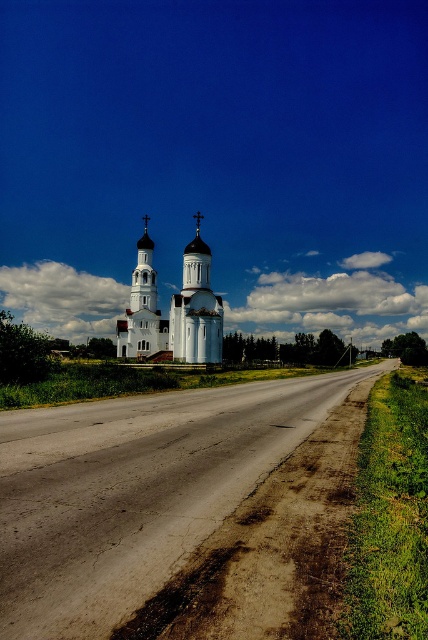
Question: Does white smooth church at center have a smaller size compared to white stone spire at center?

Choices:
 (A) no
 (B) yes

Answer: (A)

Question: Which object is positioned closest to the white stone spire at center?

Choices:
 (A) brown dirt track at center
 (B) white smooth church at center

Answer: (B)

Question: Is brown dirt track at center bigger than white stone spire at center?

Choices:
 (A) no
 (B) yes

Answer: (A)

Question: Based on their relative distances, which object is farther from the white smooth church at center?

Choices:
 (A) brown dirt track at center
 (B) white stone spire at center

Answer: (A)

Question: Which point is closer to the camera taking this photo?

Choices:
 (A) (202, 262)
 (B) (149, 266)

Answer: (A)

Question: Does brown dirt track at center appear on the right side of white stone spire at center?

Choices:
 (A) no
 (B) yes

Answer: (B)